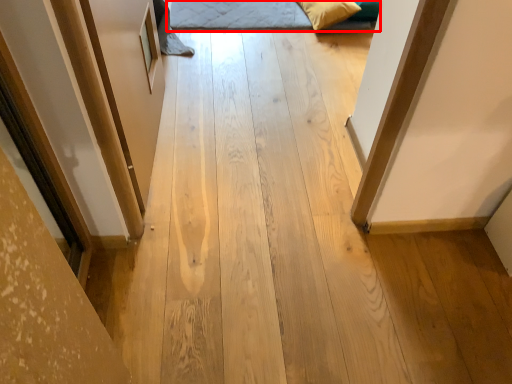
Question: From the image's perspective, what is the correct spatial relationship of bed (annotated by the red box) in relation to pillow?

Choices:
 (A) below
 (B) above

Answer: (A)